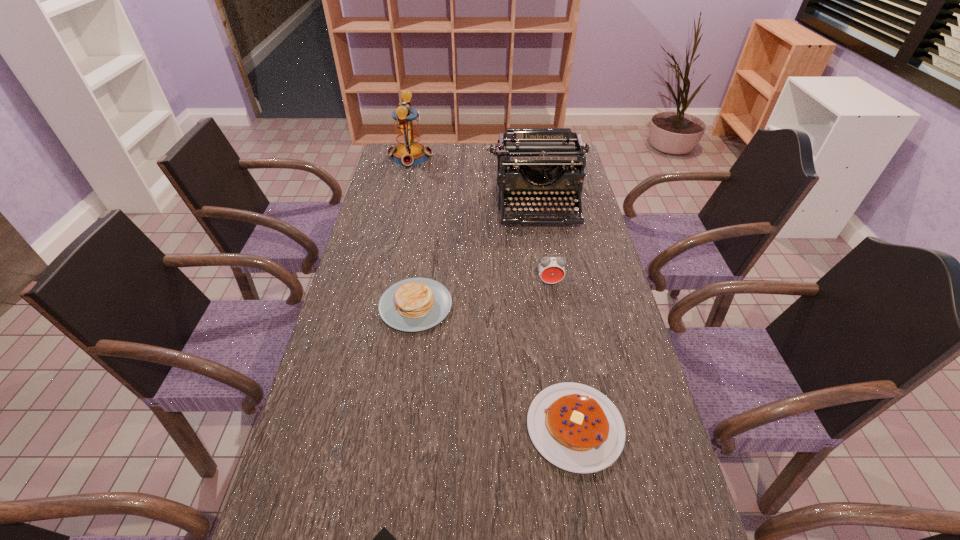
Locate an element on the screen. This screenshot has width=960, height=540. free space located 0.120m on the left of the nearer pancake is located at coordinates (473, 427).

Where is `object that is at the far edge`? Image resolution: width=960 pixels, height=540 pixels. object that is at the far edge is located at coordinates (409, 151).

Where is `lantern present at the left edge`? The height and width of the screenshot is (540, 960). lantern present at the left edge is located at coordinates (409, 151).

The image size is (960, 540). What are the coordinates of `pancake positioned at the left edge` in the screenshot? It's located at (415, 304).

I want to click on typewriter at the right edge, so click(529, 151).

You are a GUI agent. You are given a task and a screenshot of the screen. Output one action in this format:
    pyautogui.click(x=<x>, y=<y>)
    Task: Click on the alarm clock positioned at the right edge
    The height and width of the screenshot is (540, 960).
    Given the screenshot: What is the action you would take?
    pyautogui.click(x=551, y=269)

Locate an element on the screen. Image resolution: width=960 pixels, height=540 pixels. pancake situated at the right edge is located at coordinates (577, 428).

Where is `object that is at the far left corner`? The image size is (960, 540). object that is at the far left corner is located at coordinates (409, 151).

Locate an element on the screen. vacant space at the far edge is located at coordinates (448, 143).

The height and width of the screenshot is (540, 960). What are the coordinates of `vacant space at the left edge` in the screenshot? It's located at (390, 225).